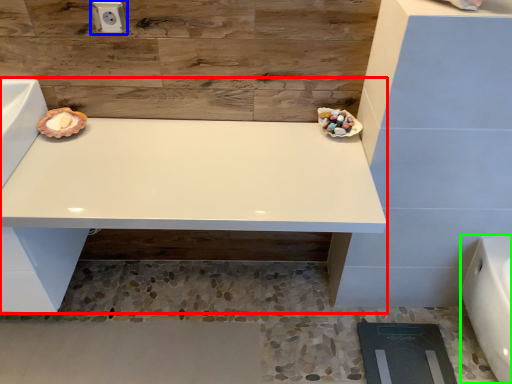
Question: Based on their relative distances, which object is nearer to vanity (highlighted by a red box)? Choose from electric outlet (highlighted by a blue box) and porcelain (highlighted by a green box).

Choices:
 (A) electric outlet
 (B) porcelain

Answer: (A)